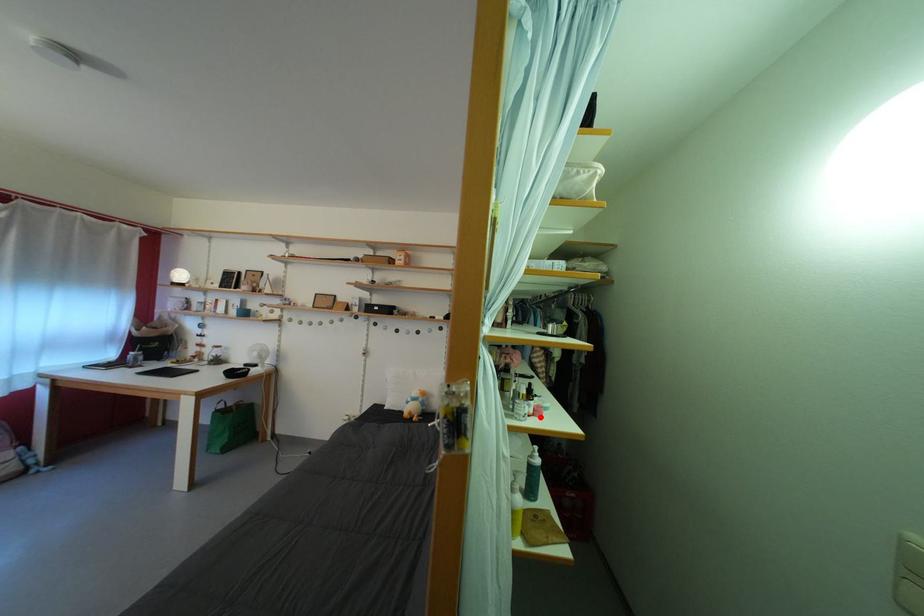
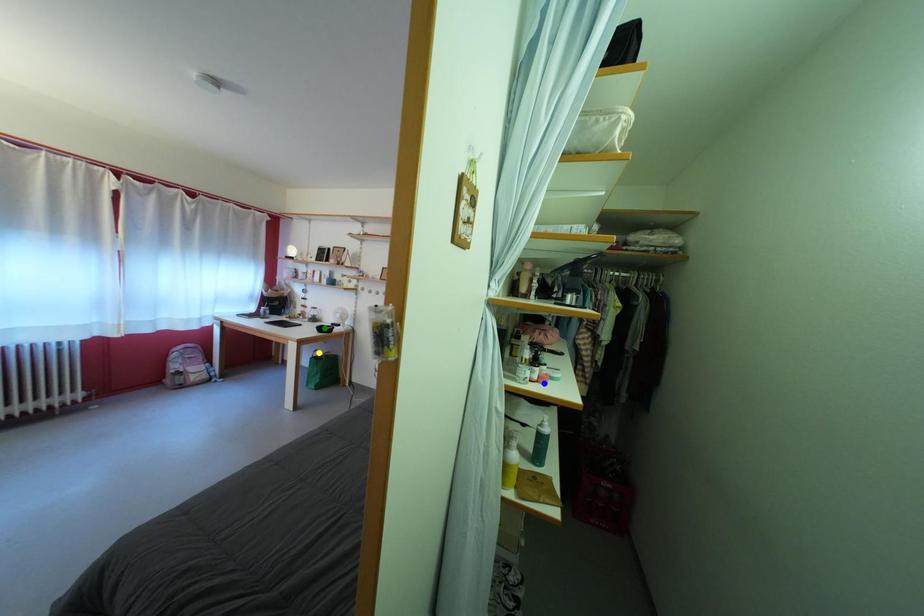
Question: I am providing you with two images of the same scene from different viewpoints. A red point is marked on the first image. You are given multiple points on the second image. Which spot in image 2 lines up with the point in image 1?

Choices:
 (A) blue point
 (B) yellow point
 (C) green point

Answer: (A)